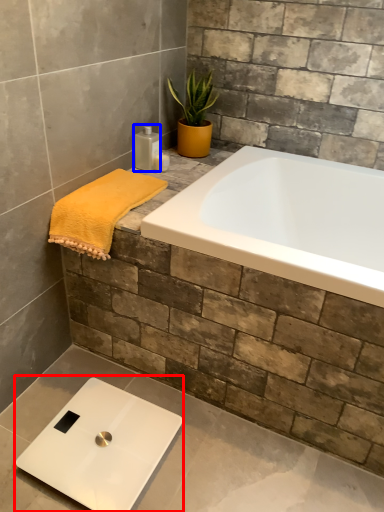
Question: Which object is closer to the camera taking this photo, scale (highlighted by a red box) or toiletry (highlighted by a blue box)?

Choices:
 (A) scale
 (B) toiletry

Answer: (A)